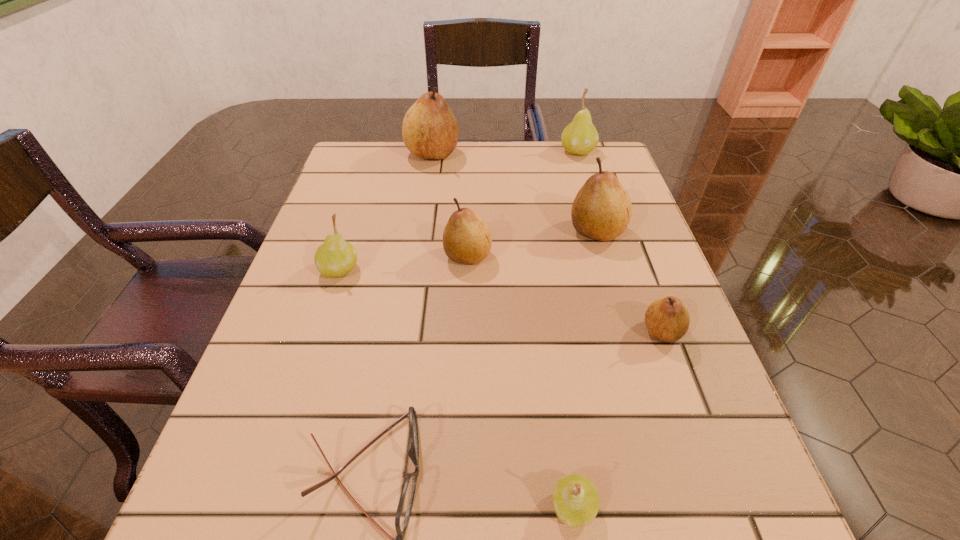
Identify the location of vacant space that is in between the third biggest brown pear and the biggest green pear. (522, 204).

I want to click on vacant area that lies between the biggest brown pear and the third biggest brown pear, so click(450, 205).

Choose which object is the seventh nearest neighbor to the third smallest brown pear. Please provide its 2D coordinates. Your answer should be formatted as a tuple, i.e. [(x, y)], where the tuple contains the x and y coordinates of a point satisfying the conditions above.

[(575, 498)]

The image size is (960, 540). I want to click on object that is the sixth closest one to the nearest brown pear, so coord(580,137).

Identify the location of pear that stands as the third closest to the biggest green pear. (467, 239).

Image resolution: width=960 pixels, height=540 pixels. I want to click on the third closest pear to the biggest brown pear, so click(x=602, y=209).

Locate which brown pear ranks second in proximity to the shortest object. Please provide its 2D coordinates. Your answer should be formatted as a tuple, i.e. [(x, y)], where the tuple contains the x and y coordinates of a point satisfying the conditions above.

[(667, 319)]

Locate which brown pear is the closest to the third biggest brown pear. Please provide its 2D coordinates. Your answer should be formatted as a tuple, i.e. [(x, y)], where the tuple contains the x and y coordinates of a point satisfying the conditions above.

[(602, 209)]

This screenshot has height=540, width=960. Identify the location of green pear that is the second closest to the rightmost green pear. (575, 498).

I want to click on green pear that is the nearest to the third smallest brown pear, so click(580, 137).